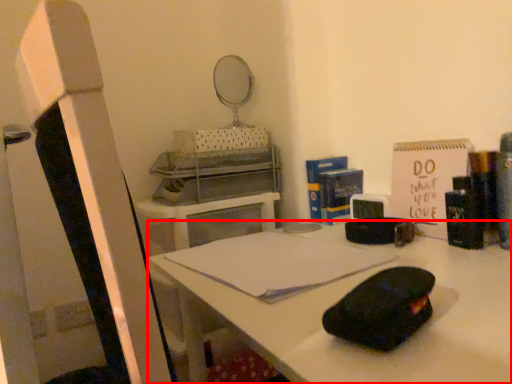
Question: From the image's perspective, considering the relative positions of desk (annotated by the red box) and notebook in the image provided, where is desk (annotated by the red box) located with respect to the staircase?

Choices:
 (A) above
 (B) below

Answer: (B)